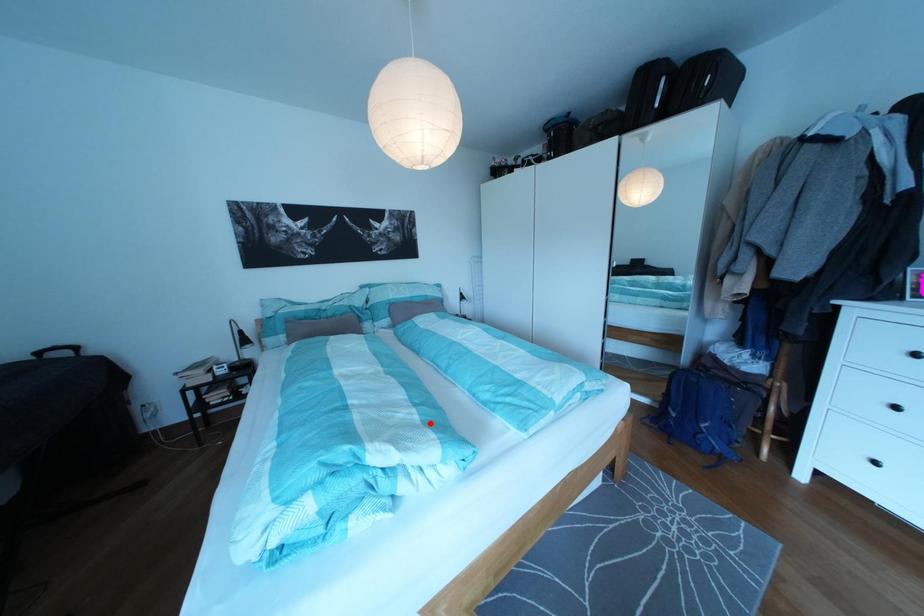
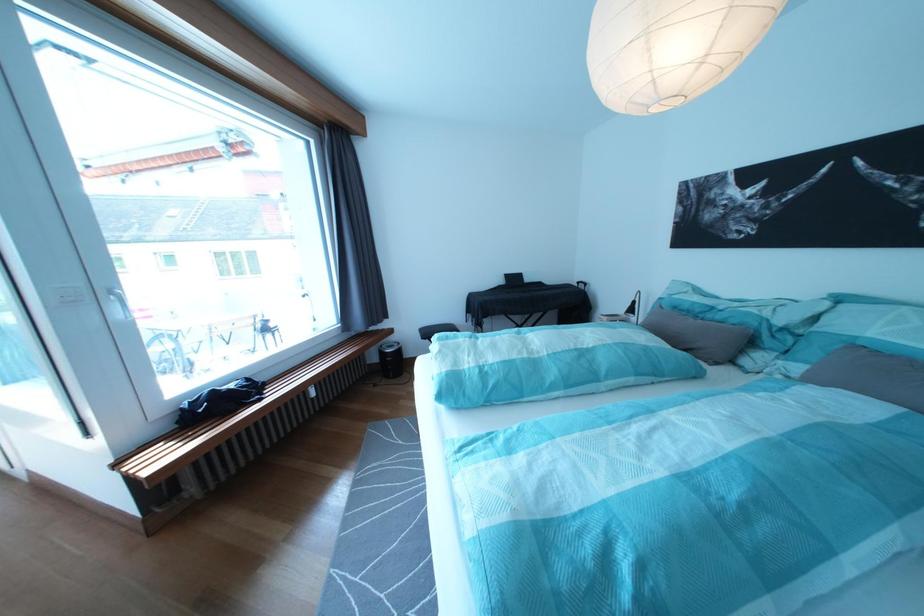
Question: I am providing you with two images of the same scene from different viewpoints. A red point is shown in image1. For the corresponding object point in image2, is it positioned nearer or farther from the camera?

Choices:
 (A) Nearer
 (B) Farther

Answer: (B)